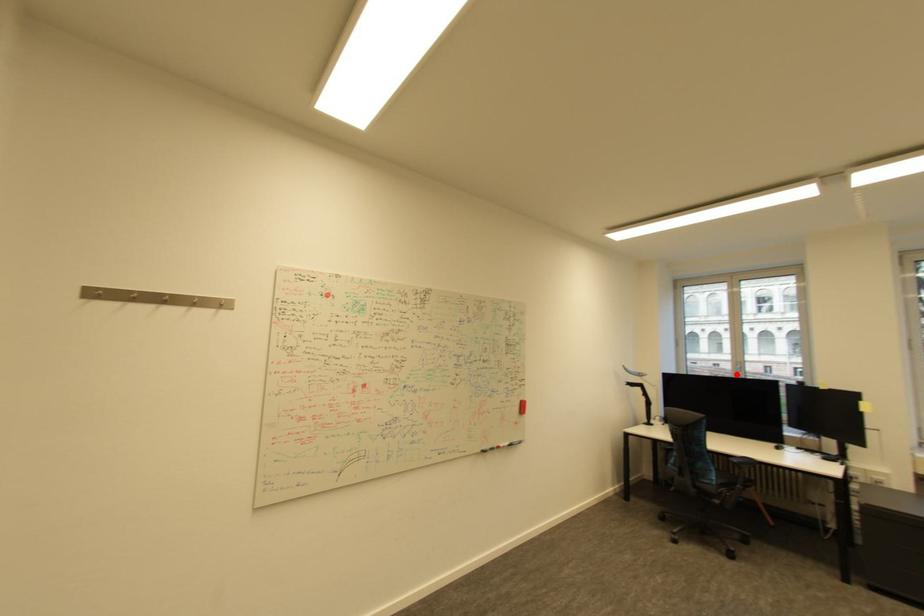
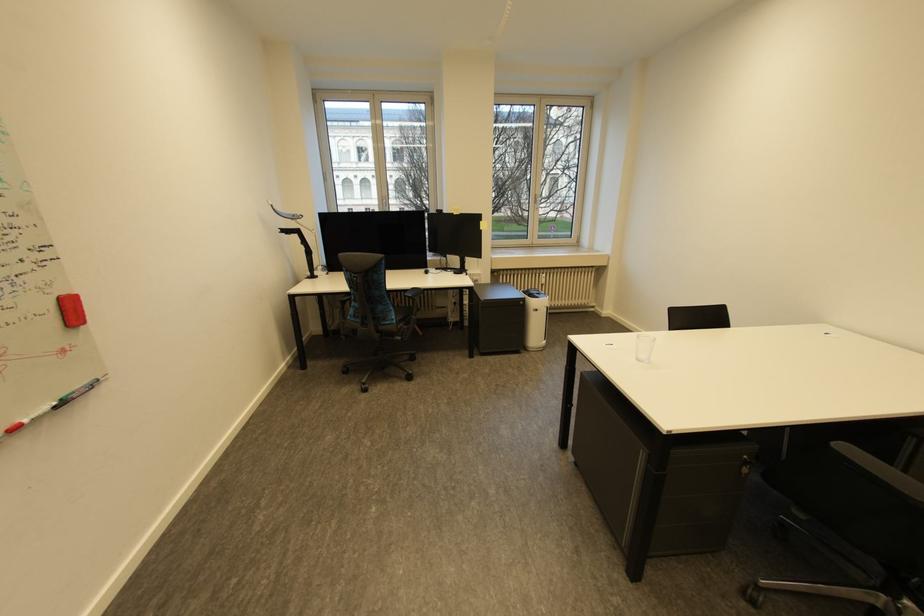
Question: I am providing you with two images of the same scene from different viewpoints. A red point is marked on the first image. Is the red point's position out of view in image 2?

Choices:
 (A) Yes
 (B) No

Answer: (B)